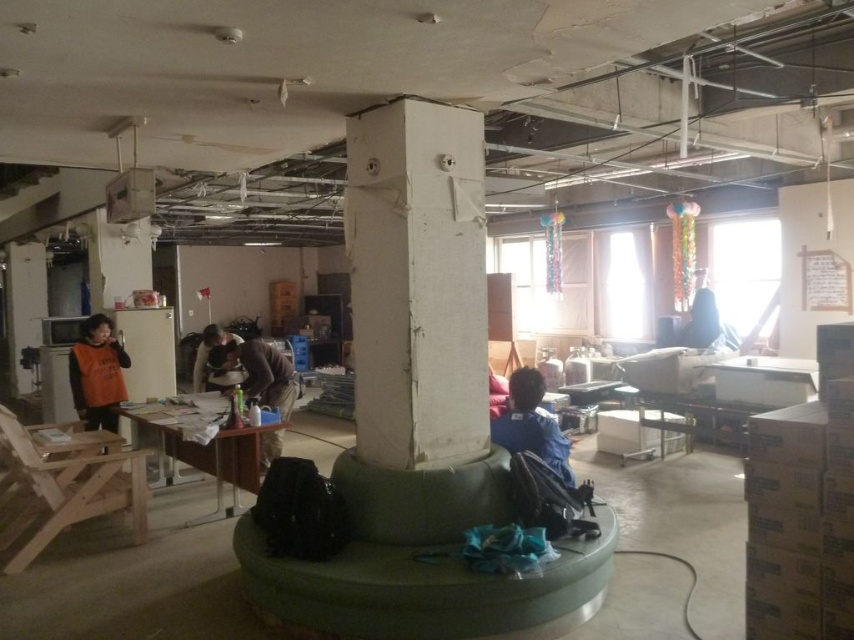
You are navigating through the renovation site and need to reach a tool located at point (237,467). There is an obstacle at point (522,403). Can you safely move from your current position to the tool without passing through the obstacle?

Point (237,467) is behind point (522,403), so you can safely move to the tool without passing through the obstacle.

You are an interior designer assessing the space. You notice the blue fabric at lower right and the dark blue fabric at upper right. Which fabric is positioned higher up in the image?

The blue fabric at lower right is taller than the dark blue fabric at upper right, so the blue fabric at lower right is positioned higher up in the image.

You are moving a 2.5 meter long ladder from the wooden desk at center to the blue fabric at lower right. Will the ladder fit through the space between them without bending it?

The wooden desk at center and blue fabric at lower right are 2.20 meters apart. Since the ladder is 2.5 meters long, it is longer than the distance between them, so the ladder cannot fit straight through without bending.